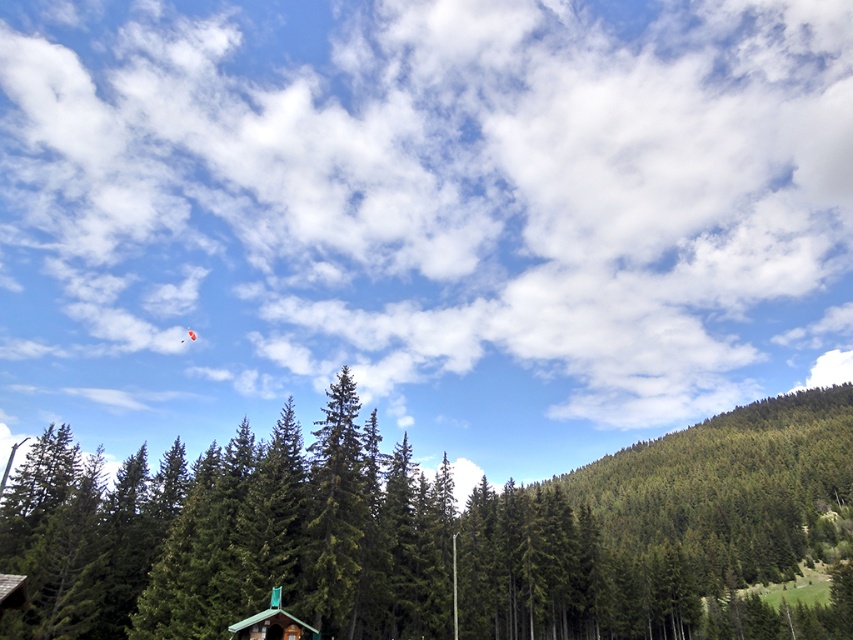
You are standing in the forest and want to walk from the point at coordinate [730,474] to the point at coordinate [254,632]. Which direction should you move relative to your current position?

You should move away from the viewer because point [254,632] is further away than point [730,474].

You are a hiker who wants to take a photo of the green matte cabin at lower center without the green matte tree at center blocking the view. Which direction should you move to ensure the tree is out of frame?

The green matte tree at center is taller than the green matte cabin at lower center. To avoid the tree blocking the view, you should move to the side opposite of where the tree is located relative to the cabin. For example, if the tree is to the left of the cabin, move to the right, or vice versa.